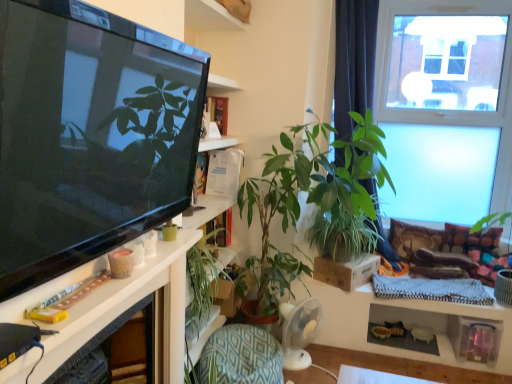
Question: Is white glossy shelf at left positioned far away from green textured cushion at lower center?

Choices:
 (A) no
 (B) yes

Answer: (A)

Question: Is white glossy shelf at left positioned before green textured cushion at lower center?

Choices:
 (A) yes
 (B) no

Answer: (A)

Question: Considering the relative sizes of white glossy shelf at left and green textured cushion at lower center in the image provided, is white glossy shelf at left thinner than green textured cushion at lower center?

Choices:
 (A) no
 (B) yes

Answer: (B)

Question: From the image's perspective, is white glossy shelf at left under green textured cushion at lower center?

Choices:
 (A) yes
 (B) no

Answer: (B)

Question: Does white glossy shelf at left have a greater height compared to green textured cushion at lower center?

Choices:
 (A) yes
 (B) no

Answer: (B)

Question: Is white glossy shelf at left inside or outside of green leafy plant at center, acting as the first houseplant starting from the left?

Choices:
 (A) inside
 (B) outside

Answer: (B)

Question: From the image's perspective, is white glossy shelf at left located above or below green leafy plant at center, the 2th houseplant positioned from the right?

Choices:
 (A) above
 (B) below

Answer: (A)

Question: Is point (189, 240) positioned closer to the camera than point (202, 322)?

Choices:
 (A) farther
 (B) closer

Answer: (B)

Question: Is white glossy shelf at left wider or thinner than green leafy plant at center, the 2th houseplant positioned from the right?

Choices:
 (A) thin
 (B) wide

Answer: (A)

Question: Considering their positions, is green textured cushion at lower center located in front of or behind white glossy shelf at left?

Choices:
 (A) behind
 (B) front

Answer: (A)

Question: From a real-world perspective, relative to white glossy shelf at left, is green textured cushion at lower center vertically above or below?

Choices:
 (A) below
 (B) above

Answer: (A)

Question: In terms of width, does green textured cushion at lower center look wider or thinner when compared to white glossy shelf at left?

Choices:
 (A) wide
 (B) thin

Answer: (A)

Question: Visually, is green textured cushion at lower center positioned to the left or to the right of white glossy shelf at left?

Choices:
 (A) left
 (B) right

Answer: (B)

Question: Is green leafy plant at center, which is the first houseplant in right-to-left order, wider or thinner than green textured cushion at lower center?

Choices:
 (A) thin
 (B) wide

Answer: (B)

Question: Would you say green leafy plant at center, which is the first houseplant in right-to-left order, is inside or outside green textured cushion at lower center?

Choices:
 (A) outside
 (B) inside

Answer: (A)